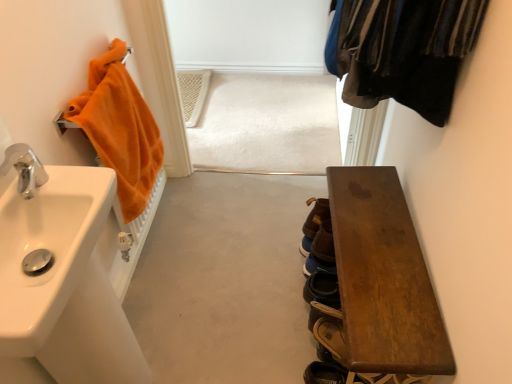
Question: Is brown suede shoe at lower center, positioned as the 3th shoe in bottom-to-top order, bigger or smaller than brown leather shoe at lower right, the third shoe viewed from the back?

Choices:
 (A) big
 (B) small

Answer: (B)

Question: Considering the positions of brown suede shoe at lower center, which is the first shoe from top to bottom, and brown leather shoe at lower right, which is counted as the first shoe, starting from the bottom, in the image, is brown suede shoe at lower center, which is the first shoe from top to bottom, wider or thinner than brown leather shoe at lower right, which is counted as the first shoe, starting from the bottom,?

Choices:
 (A) thin
 (B) wide

Answer: (A)

Question: Which of these objects is positioned farthest from the silver metallic faucet at left?

Choices:
 (A) brown leather shoe at lower right, placed as the second shoe when sorted from bottom to top
 (B) orange terry cloth towel at left
 (C) brown suede shoe at lower center, positioned as the 3th shoe in bottom-to-top order
 (D) wooden bench at lower right
 (E) brown leather shoe at lower right, the 1th shoe when ordered from front to back

Answer: (C)

Question: Estimate the real-world distances between objects in this image. Which object is closer to the silver metallic faucet at left?

Choices:
 (A) brown leather shoe at lower right, positioned as the 3th shoe in front-to-back order
 (B) wooden bench at lower right
 (C) white glossy sink at left
 (D) brown leather shoe at lower right, which is counted as the first shoe, starting from the bottom
 (E) brown suede shoe at lower center, positioned as the 3th shoe in bottom-to-top order

Answer: (C)